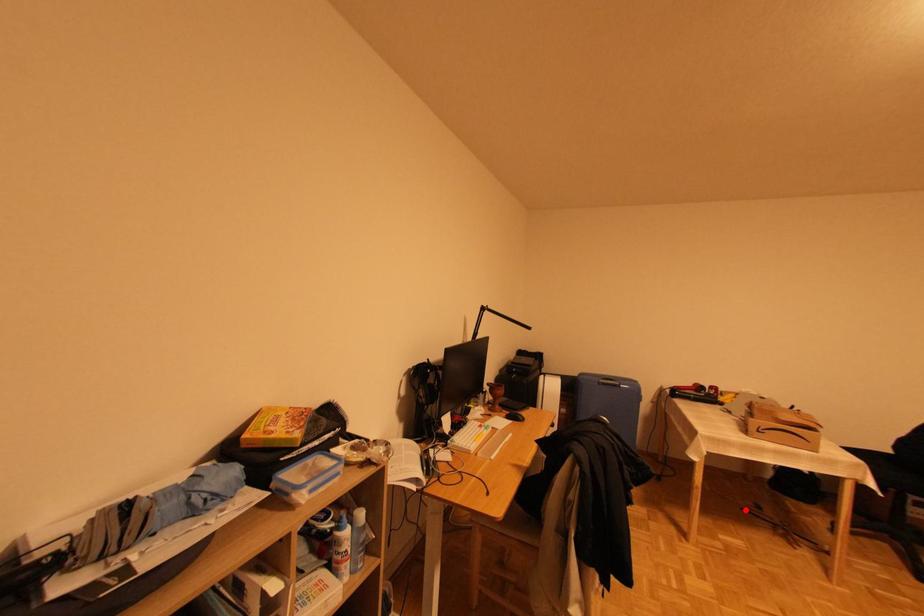
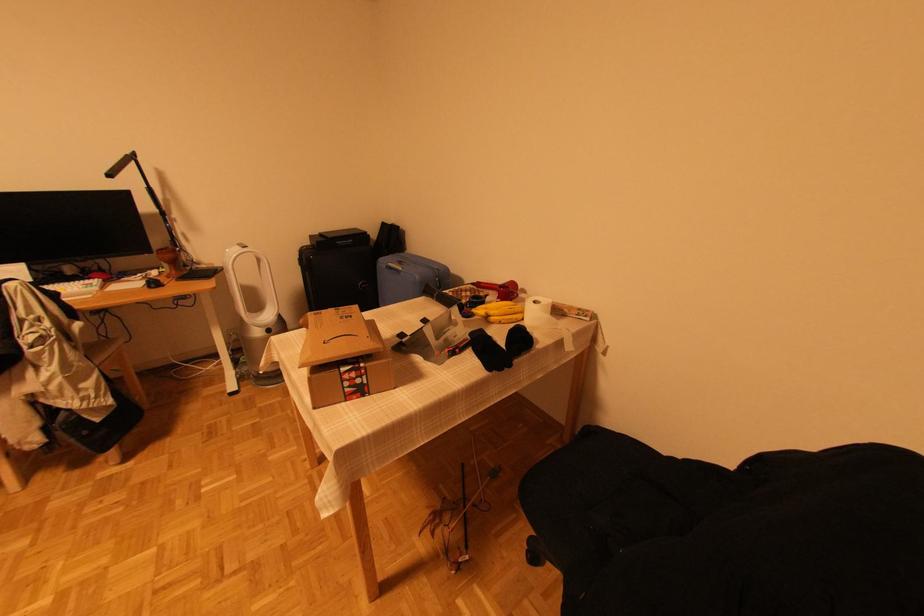
Find the pixel in the second image that matches the highlighted location in the first image.

(466, 466)